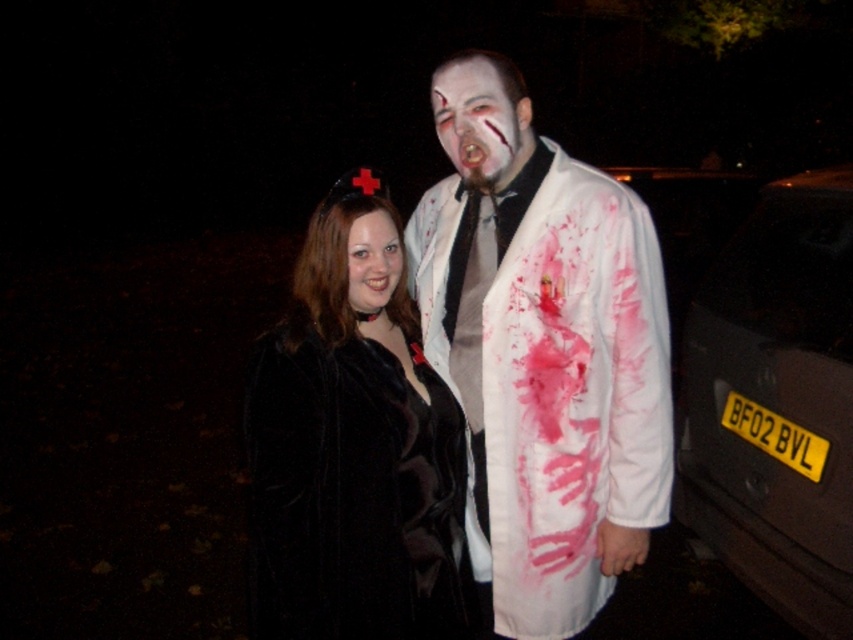
Between black fur coat at center and black plastic car at right, which one is positioned lower?

black fur coat at center is below.

Between black fur coat at center and black plastic car at right, which one has less height?

black fur coat at center is shorter.

Describe the element at coordinates (352, 458) in the screenshot. I see `black fur coat at center` at that location.

Where is `black fur coat at center`? This screenshot has width=853, height=640. black fur coat at center is located at coordinates (352, 458).

Can you confirm if white matte lab coat at center is positioned above black fur coat at center?

Yes, white matte lab coat at center is above black fur coat at center.

Is white matte lab coat at center wider than black fur coat at center?

Yes.

Who is more distant from viewer, [511,618] or [341,192]?

The point [511,618] is behind.

Locate an element on the screen. white matte lab coat at center is located at coordinates (543, 352).

Does point (485, 65) come closer to viewer compared to point (386, 272)?

No, it is not.

Between white matte face at center and smooth black hair at center, which one appears on the right side from the viewer's perspective?

Positioned to the right is white matte face at center.

Where is `white matte face at center`? This screenshot has height=640, width=853. white matte face at center is located at coordinates (474, 115).

At what (x,y) coordinates should I click in order to perform the action: click on white matte face at center. Please return your answer as a coordinate pair (x, y). Looking at the image, I should click on (474, 115).